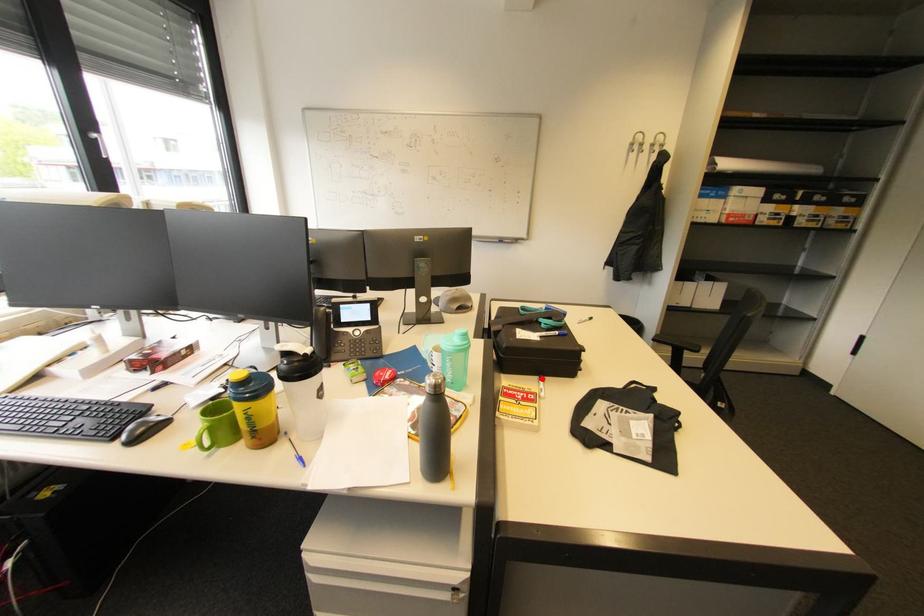
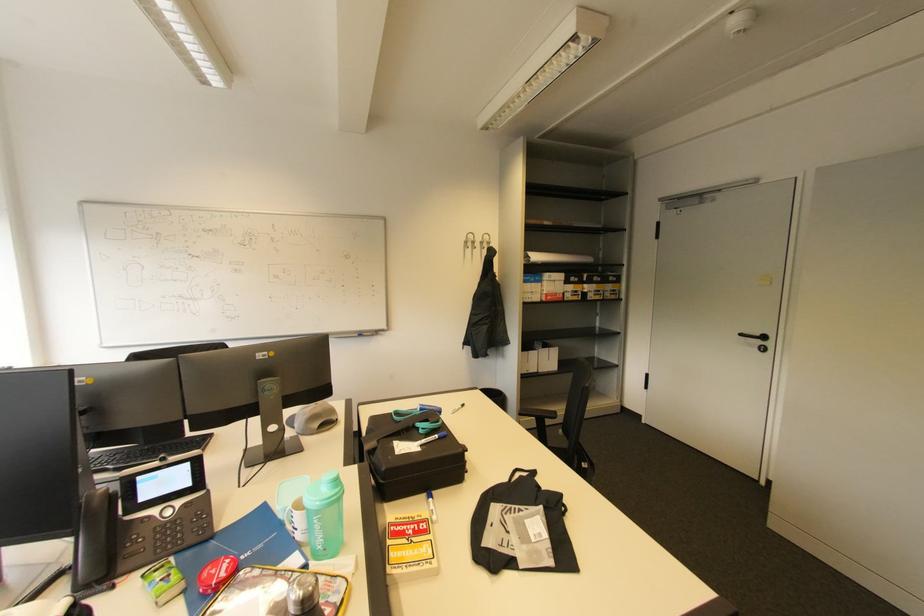
The point at the highlighted location is marked in the first image. Where is the corresponding point in the second image?

(429, 496)